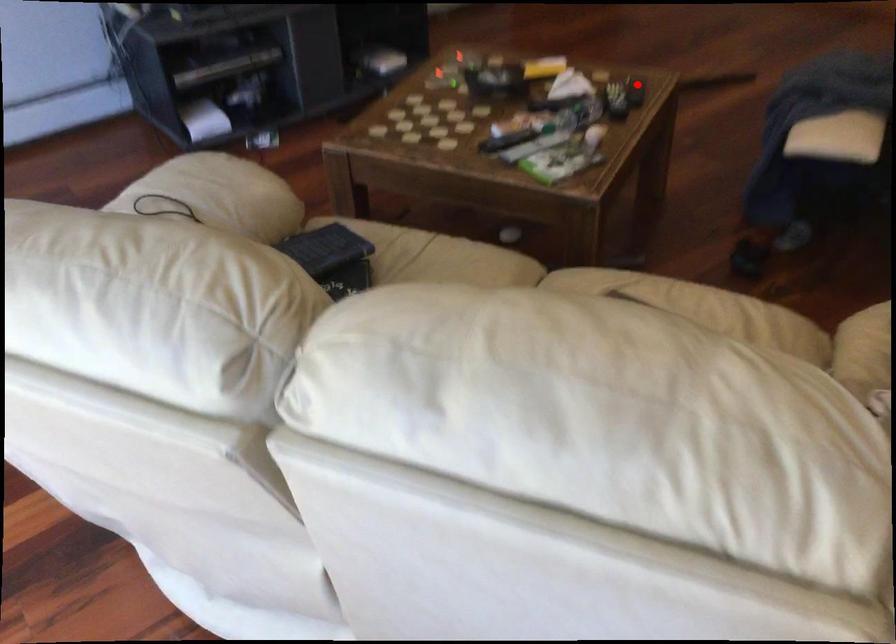
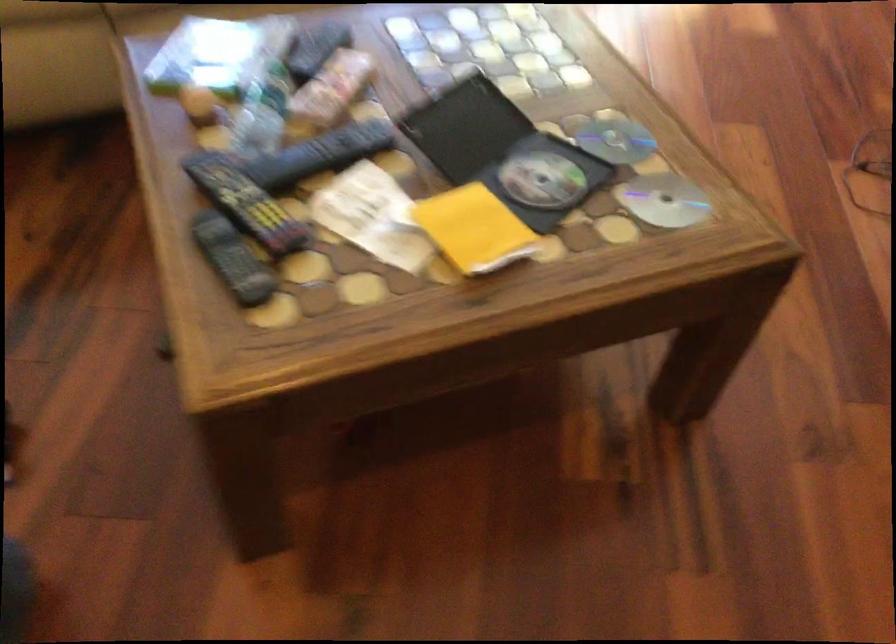
Question: I am providing you with two images of the same scene from different viewpoints. A red point is shown in image1. For the corresponding object point in image2, is it positioned nearer or farther from the camera?

Choices:
 (A) Nearer
 (B) Farther

Answer: (A)